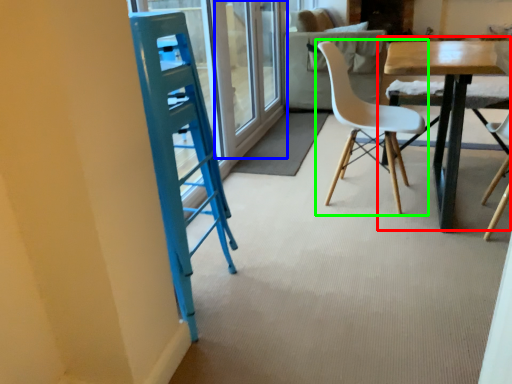
Question: Which object is the closest to the table (highlighted by a red box)? Choose among these: screen door (highlighted by a blue box) or chair (highlighted by a green box).

Choices:
 (A) screen door
 (B) chair

Answer: (B)